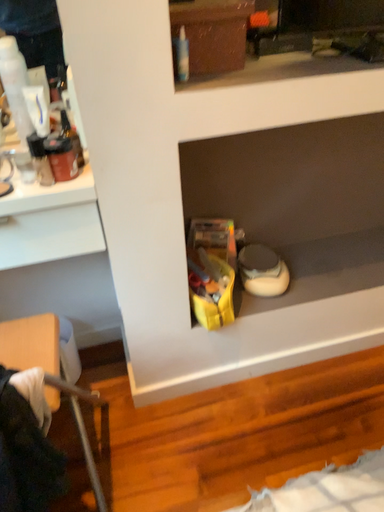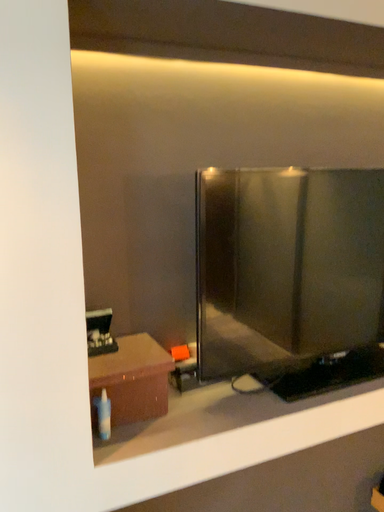
Question: How did the camera likely rotate when shooting the video?

Choices:
 (A) rotated downward
 (B) rotated upward

Answer: (B)